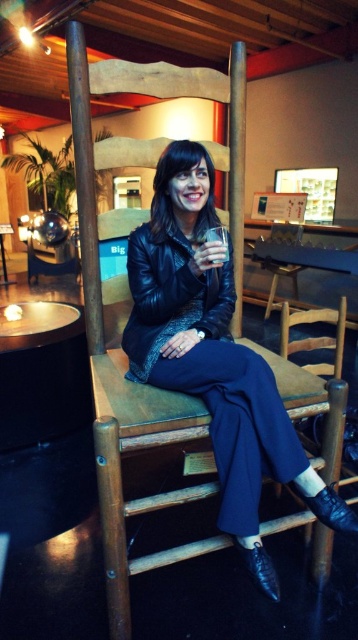
Is leather jacket at center to the right of wooden chair at center from the viewer's perspective?

No, leather jacket at center is not to the right of wooden chair at center.

Who is more distant from viewer, (x=186, y=193) or (x=283, y=228)?

Point (x=283, y=228)

Locate an element on the screen. The image size is (358, 640). leather jacket at center is located at coordinates (214, 355).

Can you confirm if black leather jacket at center is thinner than wooden chair at center?

Yes.

Does point (162, 317) come in front of point (272, 266)?

Yes, it is.

Identify the location of black leather jacket at center. The height and width of the screenshot is (640, 358). (171, 296).

Between leather jacket at center and black leather jacket at center, which one has less height?

Standing shorter between the two is black leather jacket at center.

Does point (268, 387) come behind point (136, 260)?

No, (268, 387) is closer to viewer.

Locate an element on the screen. leather jacket at center is located at coordinates (214, 355).